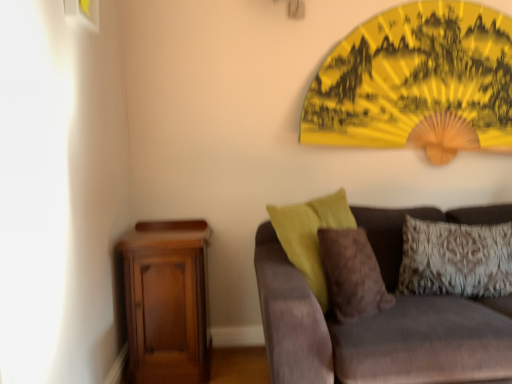
Question: Considering the relative positions of matte white picture frame at upper left and patterned fabric pillow at right, positioned as the 2th pillow in left-to-right order, in the image provided, is matte white picture frame at upper left to the left of patterned fabric pillow at right, positioned as the 2th pillow in left-to-right order, from the viewer's perspective?

Choices:
 (A) yes
 (B) no

Answer: (A)

Question: Considering the relative sizes of matte white picture frame at upper left and patterned fabric pillow at right, marked as the 1th pillow in a right-to-left arrangement, in the image provided, is matte white picture frame at upper left shorter than patterned fabric pillow at right, marked as the 1th pillow in a right-to-left arrangement,?

Choices:
 (A) no
 (B) yes

Answer: (B)

Question: From a real-world perspective, is matte white picture frame at upper left over patterned fabric pillow at right, marked as the 1th pillow in a right-to-left arrangement?

Choices:
 (A) no
 (B) yes

Answer: (B)

Question: Is matte white picture frame at upper left behind patterned fabric pillow at right, marked as the 1th pillow in a right-to-left arrangement?

Choices:
 (A) no
 (B) yes

Answer: (A)

Question: Would you say matte white picture frame at upper left is outside patterned fabric pillow at right, positioned as the 2th pillow in left-to-right order?

Choices:
 (A) yes
 (B) no

Answer: (A)

Question: From their relative heights in the image, would you say mahogany wood nightstand at lower left is taller or shorter than matte white picture frame at upper left?

Choices:
 (A) short
 (B) tall

Answer: (B)

Question: Is point (174, 332) positioned closer to the camera than point (92, 23)?

Choices:
 (A) farther
 (B) closer

Answer: (A)

Question: From the image's perspective, is mahogany wood nightstand at lower left located above or below matte white picture frame at upper left?

Choices:
 (A) above
 (B) below

Answer: (B)

Question: Relative to matte white picture frame at upper left, is mahogany wood nightstand at lower left in front or behind?

Choices:
 (A) behind
 (B) front

Answer: (A)

Question: Relative to brown fuzzy pillow at center, which appears as the 1th pillow when viewed from the left, is patterned fabric pillow at right, marked as the 1th pillow in a right-to-left arrangement, in front or behind?

Choices:
 (A) behind
 (B) front

Answer: (A)

Question: Do you think patterned fabric pillow at right, marked as the 1th pillow in a right-to-left arrangement, is within brown fuzzy pillow at center, which appears as the 1th pillow when viewed from the left, or outside of it?

Choices:
 (A) outside
 (B) inside

Answer: (A)

Question: Considering the relative positions of patterned fabric pillow at right, positioned as the 2th pillow in left-to-right order, and brown fuzzy pillow at center, the 2th pillow viewed from the right, in the image provided, is patterned fabric pillow at right, positioned as the 2th pillow in left-to-right order, to the left or to the right of brown fuzzy pillow at center, the 2th pillow viewed from the right,?

Choices:
 (A) left
 (B) right

Answer: (B)

Question: Is patterned fabric pillow at right, marked as the 1th pillow in a right-to-left arrangement, taller or shorter than brown fuzzy pillow at center, the 2th pillow viewed from the right?

Choices:
 (A) short
 (B) tall

Answer: (A)

Question: Considering the positions of velvet brown couch at lower right and patterned fabric pillow at right, positioned as the 2th pillow in left-to-right order, in the image, is velvet brown couch at lower right taller or shorter than patterned fabric pillow at right, positioned as the 2th pillow in left-to-right order,?

Choices:
 (A) short
 (B) tall

Answer: (B)

Question: From a real-world perspective, is velvet brown couch at lower right physically located above or below patterned fabric pillow at right, marked as the 1th pillow in a right-to-left arrangement?

Choices:
 (A) above
 (B) below

Answer: (B)